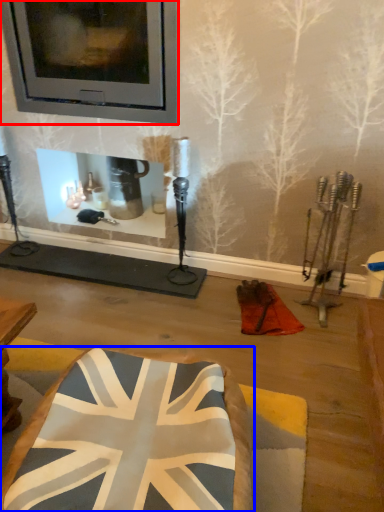
Question: Which point is further to the camera, picture frame (highlighted by a red box) or furniture (highlighted by a blue box)?

Choices:
 (A) picture frame
 (B) furniture

Answer: (A)